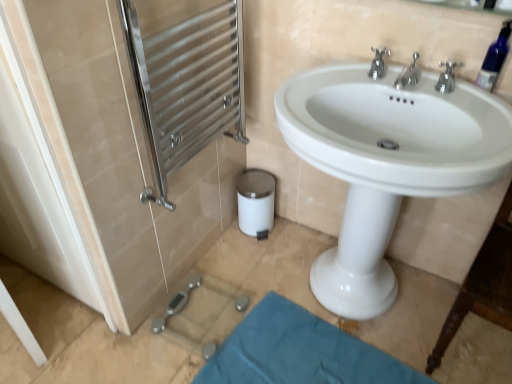
What is the approximate width of polished chrome faucet at upper center, the 2th tap positioned from the left?

polished chrome faucet at upper center, the 2th tap positioned from the left, is 5.77 inches in width.

Image resolution: width=512 pixels, height=384 pixels. I want to click on transparent plastic bottle at upper right, so pyautogui.click(x=494, y=58).

I want to click on white glossy sink at center, so click(x=386, y=163).

You are a GUI agent. You are given a task and a screenshot of the screen. Output one action in this format:
    pyautogui.click(x=<x>, y=<y>)
    Task: Click on the polished stainless steel towel rack at left, the first screen door when ordered from right to left
    The width and height of the screenshot is (512, 384).
    Given the screenshot: What is the action you would take?
    pyautogui.click(x=187, y=86)

Where is `polished chrome faucet at upper center, the third tap when ordered from right to left`? polished chrome faucet at upper center, the third tap when ordered from right to left is located at coordinates (378, 63).

Locate an element on the screen. This screenshot has width=512, height=384. silver metallic faucet at upper right, the 1th tap from the right is located at coordinates (447, 77).

Measure the distance between white glossy sink at center and white glossy screen door at left, which ranks as the first screen door in left-to-right order.

white glossy sink at center is 34.52 inches from white glossy screen door at left, which ranks as the first screen door in left-to-right order.

In the scene shown: Considering the relative positions of white glossy sink at center and white glossy screen door at left, the 2th screen door when ordered from right to left, in the image provided, is white glossy sink at center behind white glossy screen door at left, the 2th screen door when ordered from right to left,?

No, it is in front of white glossy screen door at left, the 2th screen door when ordered from right to left.

Looking at this image, would you say white glossy screen door at left, which ranks as the first screen door in left-to-right order, is part of white glossy sink at center's contents?

Actually, white glossy screen door at left, which ranks as the first screen door in left-to-right order, is outside white glossy sink at center.

Considering the sizes of objects white glossy sink at center and white glossy screen door at left, the 2th screen door when ordered from right to left, in the image provided, who is thinner, white glossy sink at center or white glossy screen door at left, the 2th screen door when ordered from right to left,?

white glossy screen door at left, the 2th screen door when ordered from right to left.

Is point (333, 368) behind point (482, 125)?

That is True.

Are teal fabric bath mat at lower center and white glossy sink at center beside each other?

No.

Could you tell me if teal fabric bath mat at lower center is facing white glossy sink at center?

No, teal fabric bath mat at lower center is not facing towards white glossy sink at center.

Which object is closer to the camera taking this photo, teal fabric bath mat at lower center or white glossy sink at center?

white glossy sink at center is closer to the camera.

From the image's perspective, is white glossy sink at center under polished chrome faucet at upper center, the first tap from the left?

Correct, white glossy sink at center appears lower than polished chrome faucet at upper center, the first tap from the left, in the image.

Is white glossy sink at center completely or partially outside of polished chrome faucet at upper center, the third tap when ordered from right to left?

Yes, white glossy sink at center is located beyond the bounds of polished chrome faucet at upper center, the third tap when ordered from right to left.

Could you measure the distance between white glossy sink at center and polished chrome faucet at upper center, the first tap from the left?

They are 15.70 inches apart.

Between white glossy sink at center and polished chrome faucet at upper center, the first tap from the left, which one has smaller size?

Smaller between the two is polished chrome faucet at upper center, the first tap from the left.

From a real-world perspective, which is physically below, white glossy screen door at left, which ranks as the first screen door in left-to-right order, or polished chrome faucet at upper center, the first tap from the left?

In real-world perspective, white glossy screen door at left, which ranks as the first screen door in left-to-right order, is lower.

Is white glossy screen door at left, which ranks as the first screen door in left-to-right order, looking in the opposite direction of polished chrome faucet at upper center, the third tap when ordered from right to left?

No, white glossy screen door at left, which ranks as the first screen door in left-to-right order, is not facing the opposite direction of polished chrome faucet at upper center, the third tap when ordered from right to left.

Is white glossy screen door at left, the 2th screen door when ordered from right to left, situated inside polished chrome faucet at upper center, the first tap from the left, or outside?

white glossy screen door at left, the 2th screen door when ordered from right to left, is outside polished chrome faucet at upper center, the first tap from the left.

Is polished stainless steel towel rack at left, the 2th screen door in the left-to-right sequence, surrounded by white glossy sink at center?

No, polished stainless steel towel rack at left, the 2th screen door in the left-to-right sequence, is not surrounded by white glossy sink at center.

Which of these two, white glossy sink at center or polished stainless steel towel rack at left, the first screen door when ordered from right to left, is thinner?

With smaller width is polished stainless steel towel rack at left, the first screen door when ordered from right to left.

Are white glossy sink at center and polished stainless steel towel rack at left, the first screen door when ordered from right to left, making contact?

No, white glossy sink at center is not next to polished stainless steel towel rack at left, the first screen door when ordered from right to left.

Based on the photo, how far apart are white glossy sink at center and polished stainless steel towel rack at left, the first screen door when ordered from right to left?

49.71 centimeters.

Considering the sizes of teal fabric bath mat at lower center and polished stainless steel towel rack at left, the 2th screen door in the left-to-right sequence, in the image, is teal fabric bath mat at lower center wider or thinner than polished stainless steel towel rack at left, the 2th screen door in the left-to-right sequence,?

teal fabric bath mat at lower center is wider than polished stainless steel towel rack at left, the 2th screen door in the left-to-right sequence.

From a real-world perspective, count 2nd screen doors upward from the teal fabric bath mat at lower center and point to it. Please provide its 2D coordinates.

[(187, 86)]

Is teal fabric bath mat at lower center further to camera compared to polished stainless steel towel rack at left, the 2th screen door in the left-to-right sequence?

Yes, the depth of teal fabric bath mat at lower center is greater than that of polished stainless steel towel rack at left, the 2th screen door in the left-to-right sequence.

Based on the photo, which point is more forward, (x=313, y=320) or (x=207, y=83)?

The point (x=207, y=83) is closer.

In terms of height, does white glossy sink at center look taller or shorter compared to silver metallic faucet at upper right, which is the third tap in left-to-right order?

white glossy sink at center is taller than silver metallic faucet at upper right, which is the third tap in left-to-right order.

Is white glossy sink at center positioned beyond the bounds of silver metallic faucet at upper right, which is the third tap in left-to-right order?

Absolutely, white glossy sink at center is external to silver metallic faucet at upper right, which is the third tap in left-to-right order.

Considering the sizes of objects white glossy sink at center and silver metallic faucet at upper right, the 1th tap from the right, in the image provided, who is wider, white glossy sink at center or silver metallic faucet at upper right, the 1th tap from the right,?

white glossy sink at center is wider.

Between white glossy sink at center and silver metallic faucet at upper right, the 1th tap from the right, which one appears on the right side from the viewer's perspective?

silver metallic faucet at upper right, the 1th tap from the right.

I want to click on the 2nd screen door to the left of the white glossy sink at center, counting from the anchor's position, so click(38, 189).

Locate an element on the screen. sink to the right of teal fabric bath mat at lower center is located at coordinates (386, 163).

When comparing their distances from white glossy screen door at left, which ranks as the first screen door in left-to-right order, does white glossy sink at center or transparent plastic bottle at upper right seem closer?

white glossy sink at center is positioned closer to the anchor white glossy screen door at left, which ranks as the first screen door in left-to-right order.

When comparing their distances from polished chrome faucet at upper center, which appears as the 2th tap when viewed from the right, does polished chrome faucet at upper center, the third tap when ordered from right to left, or white glossy screen door at left, the 2th screen door when ordered from right to left, seem further?

white glossy screen door at left, the 2th screen door when ordered from right to left, is positioned further to the anchor polished chrome faucet at upper center, which appears as the 2th tap when viewed from the right.

Which object lies further to the anchor point transparent plastic bottle at upper right, white glossy sink at center or white glossy screen door at left, which ranks as the first screen door in left-to-right order?

The object further to transparent plastic bottle at upper right is white glossy screen door at left, which ranks as the first screen door in left-to-right order.

Looking at the image, which one is located further to polished stainless steel towel rack at left, the 2th screen door in the left-to-right sequence, white glossy sink at center or white glossy screen door at left, the 2th screen door when ordered from right to left?

white glossy sink at center is further to polished stainless steel towel rack at left, the 2th screen door in the left-to-right sequence.

Considering their positions, is teal fabric bath mat at lower center positioned closer to silver metallic faucet at upper right, the 1th tap from the right, than white glossy screen door at left, which ranks as the first screen door in left-to-right order?

teal fabric bath mat at lower center.

When comparing their distances from polished chrome faucet at upper center, the first tap from the left, does silver metallic faucet at upper right, which is the third tap in left-to-right order, or polished chrome faucet at upper center, the 2th tap positioned from the left, seem closer?

polished chrome faucet at upper center, the 2th tap positioned from the left, lies closer to polished chrome faucet at upper center, the first tap from the left, than the other object.

Estimate the real-world distances between objects in this image. Which object is further from teal fabric bath mat at lower center, transparent plastic bottle at upper right or polished stainless steel towel rack at left, the first screen door when ordered from right to left?

transparent plastic bottle at upper right is positioned further to the anchor teal fabric bath mat at lower center.

Considering their positions, is white glossy screen door at left, which ranks as the first screen door in left-to-right order, positioned further to transparent plastic bottle at upper right than teal fabric bath mat at lower center?

white glossy screen door at left, which ranks as the first screen door in left-to-right order, lies further to transparent plastic bottle at upper right than the other object.

Where is `bath mat between white glossy screen door at left, which ranks as the first screen door in left-to-right order, and polished chrome faucet at upper center, the first tap from the left, from left to right`? bath mat between white glossy screen door at left, which ranks as the first screen door in left-to-right order, and polished chrome faucet at upper center, the first tap from the left, from left to right is located at coordinates (298, 352).

You are a GUI agent. You are given a task and a screenshot of the screen. Output one action in this format:
    pyautogui.click(x=<x>, y=<y>)
    Task: Click on the tap located between polished chrome faucet at upper center, the 2th tap positioned from the left, and transparent plastic bottle at upper right in the left-right direction
    This screenshot has height=384, width=512.
    Given the screenshot: What is the action you would take?
    pyautogui.click(x=447, y=77)

Locate an element on the screen. The width and height of the screenshot is (512, 384). sink situated between white glossy screen door at left, the 2th screen door when ordered from right to left, and polished chrome faucet at upper center, which appears as the 2th tap when viewed from the right, from left to right is located at coordinates (386, 163).

The width and height of the screenshot is (512, 384). In order to click on bottle between polished chrome faucet at upper center, the third tap when ordered from right to left, and white glossy sink at center vertically in this screenshot , I will do `click(494, 58)`.